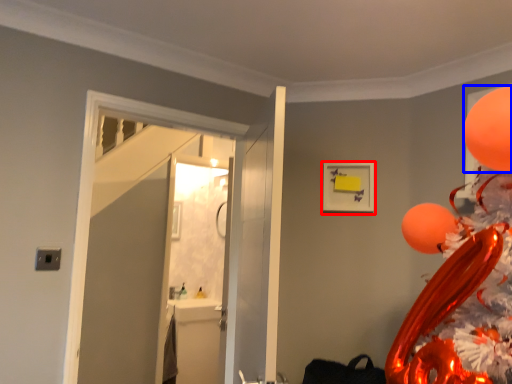
Question: Which point is further to the camera, picture frame (highlighted by a red box) or balloon (highlighted by a blue box)?

Choices:
 (A) picture frame
 (B) balloon

Answer: (A)